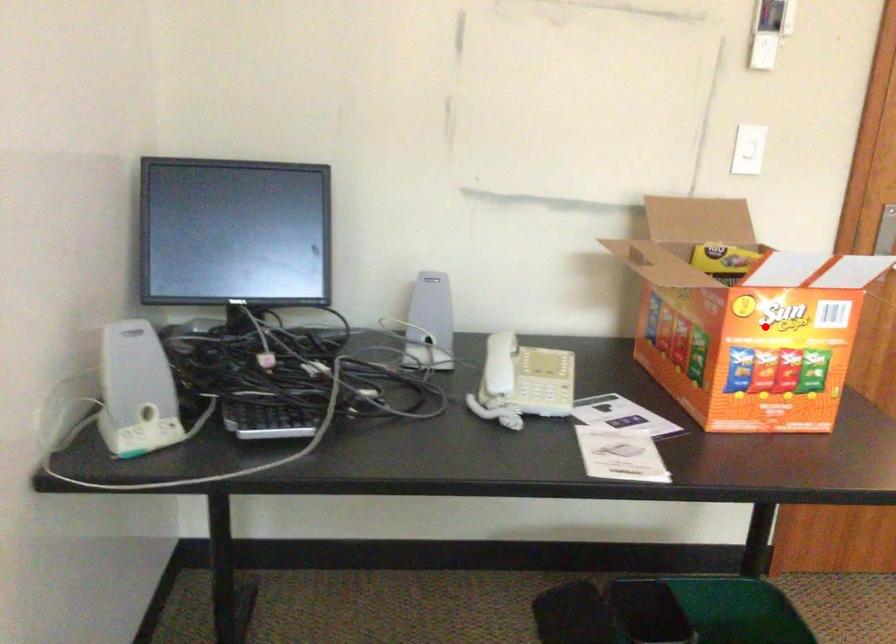
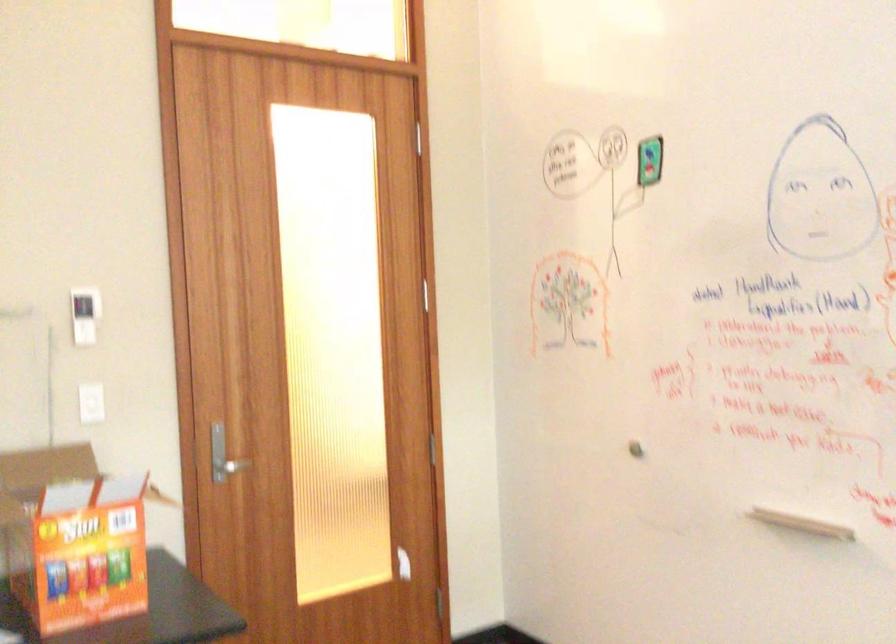
Locate, in the second image, the point that corresponds to the highlighted location in the first image.

(72, 538)